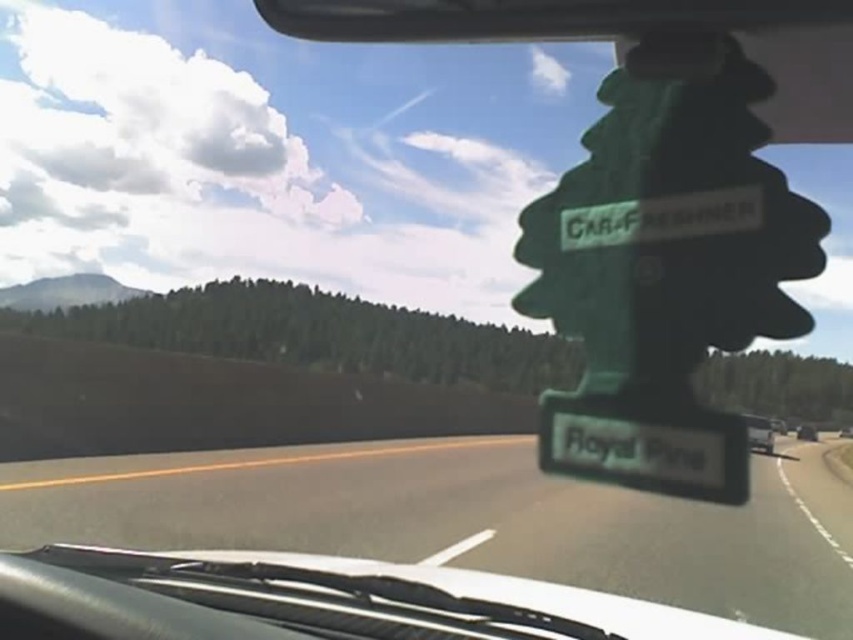
Describe the element at coordinates (450, 525) in the screenshot. I see `black asphalt highway at center` at that location.

Which is in front, point (837, 538) or point (753, 420)?

Point (837, 538)

You are a GUI agent. You are given a task and a screenshot of the screen. Output one action in this format:
    pyautogui.click(x=<x>, y=<y>)
    Task: Click on the black asphalt highway at center
    This screenshot has height=640, width=853.
    Given the screenshot: What is the action you would take?
    pyautogui.click(x=450, y=525)